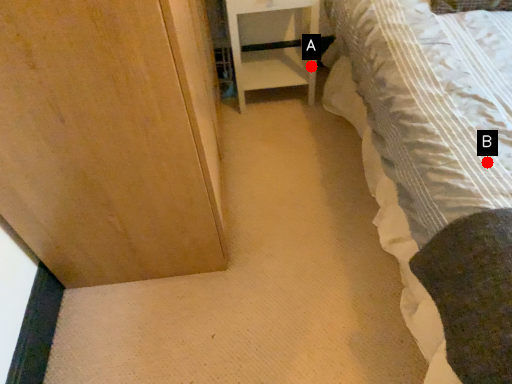
Question: Two points are circled on the image, labeled by A and B beside each circle. Among these points, which one is farthest from the camera?

Choices:
 (A) A is further
 (B) B is further

Answer: (A)